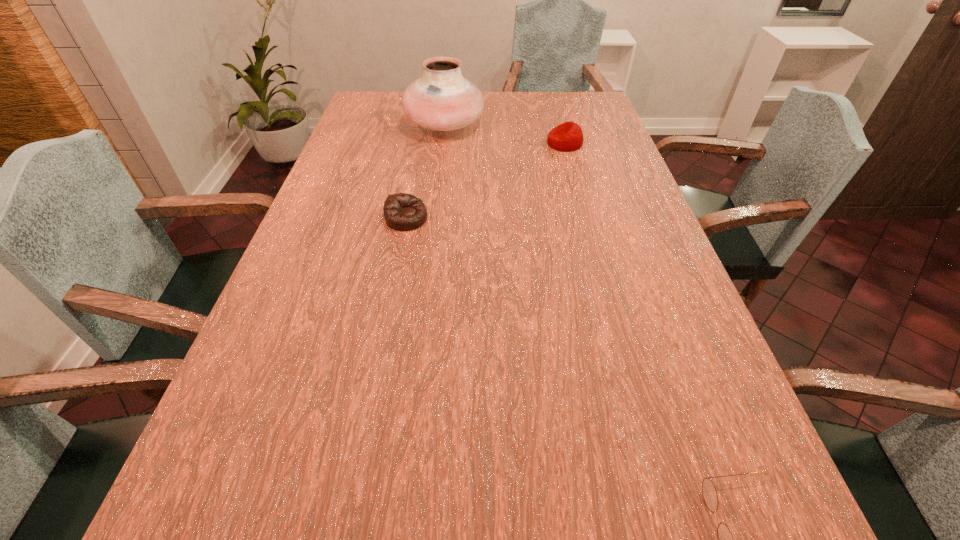
This screenshot has height=540, width=960. Identify the location of object that is at the far edge. (442, 99).

Where is `object that is positioned at the right edge`? The width and height of the screenshot is (960, 540). object that is positioned at the right edge is located at coordinates (568, 136).

The image size is (960, 540). In order to click on vacant area at the far edge of the desktop in this screenshot , I will do `click(528, 103)`.

Locate an element on the screen. free space at the left edge of the desktop is located at coordinates (347, 131).

You are a GUI agent. You are given a task and a screenshot of the screen. Output one action in this format:
    pyautogui.click(x=<x>, y=<y>)
    Task: Click on the free space at the right edge
    This screenshot has width=960, height=540.
    Given the screenshot: What is the action you would take?
    pyautogui.click(x=613, y=299)

This screenshot has width=960, height=540. In order to click on vacant area at the far left corner of the desktop in this screenshot , I will do `click(388, 102)`.

Find the location of a particular element. This screenshot has width=960, height=540. free space between the left beanbag and the pottery is located at coordinates (425, 172).

I want to click on vacant area between the left beanbag and the tallest object, so click(425, 172).

Identify the location of vacant area between the pottery and the second tallest object. This screenshot has height=540, width=960. (505, 134).

Where is `vacant space in between the shorter beanbag and the pottery`? Image resolution: width=960 pixels, height=540 pixels. vacant space in between the shorter beanbag and the pottery is located at coordinates (425, 172).